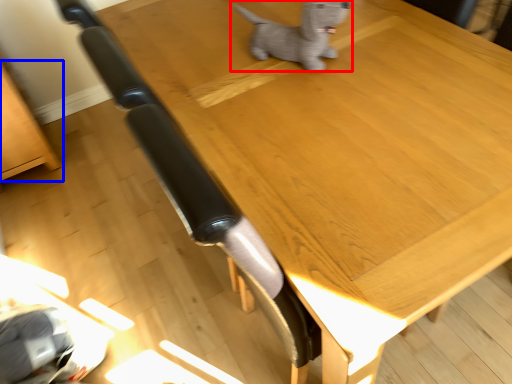
Question: Which of the following is the farthest to the observer, dog (highlighted by a red box) or furniture (highlighted by a blue box)?

Choices:
 (A) dog
 (B) furniture

Answer: (B)